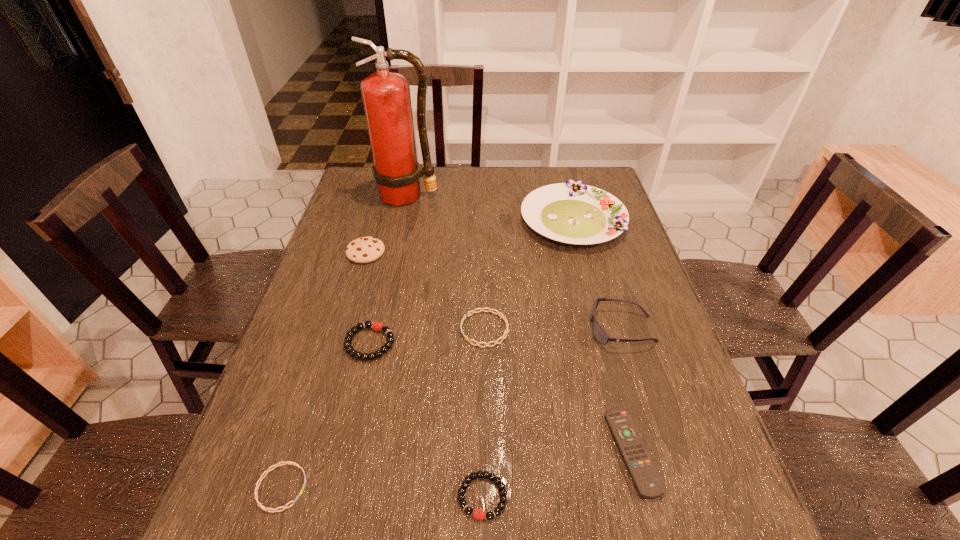
Find the location of a particular element. This screenshot has width=960, height=540. free space at the right edge of the desktop is located at coordinates (694, 443).

You are a GUI agent. You are given a task and a screenshot of the screen. Output one action in this format:
    pyautogui.click(x=<x>, y=<y>)
    Task: Click on the vacant area at the far left corner
    Image resolution: width=960 pixels, height=540 pixels.
    Given the screenshot: What is the action you would take?
    pyautogui.click(x=362, y=187)

The image size is (960, 540). In the image, there is a desktop. In order to click on vacant area at the far right corner in this screenshot , I will do [592, 179].

Image resolution: width=960 pixels, height=540 pixels. In order to click on unoccupied position between the sixth shortest object and the nearer black bracelet in this screenshot , I will do `click(424, 374)`.

At what (x,y) coordinates should I click in order to perform the action: click on empty space that is in between the red fire extinguisher and the farther blue bracelet. Please return your answer as a coordinate pair (x, y). Looking at the image, I should click on click(446, 262).

Where is `unoccupied area between the brown cookie and the sunglasses`? This screenshot has width=960, height=540. unoccupied area between the brown cookie and the sunglasses is located at coordinates (493, 291).

Locate an element on the screen. The width and height of the screenshot is (960, 540). empty location between the brown cookie and the salad plate is located at coordinates (469, 236).

I want to click on unoccupied area between the right blue bracelet and the nearer blue bracelet, so click(x=383, y=408).

Identify the location of free space between the nearer blue bracelet and the right blue bracelet. Image resolution: width=960 pixels, height=540 pixels. (383, 408).

The image size is (960, 540). I want to click on empty space between the remote control and the nearer black bracelet, so [x=558, y=474].